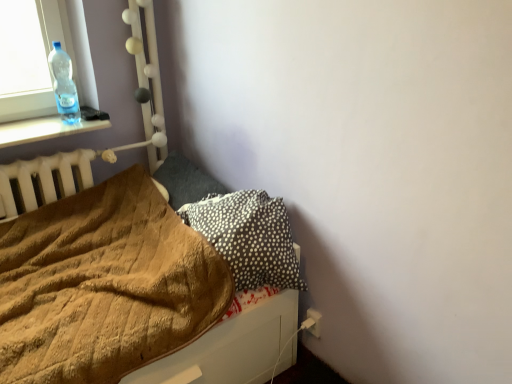
Question: Considering their positions, is black dotted pillow at lower right, acting as the 2th pillow starting from the back, located in front of or behind dark gray fabric pillow at center-left, which appears as the 1th pillow when viewed from the back?

Choices:
 (A) front
 (B) behind

Answer: (A)

Question: In terms of size, does black dotted pillow at lower right, acting as the 2th pillow starting from the back, appear bigger or smaller than dark gray fabric pillow at center-left, which appears as the 1th pillow when viewed from the back?

Choices:
 (A) small
 (B) big

Answer: (B)

Question: Estimate the real-world distances between objects in this image. Which object is closer to the dark gray fabric pillow at center-left, placed as the 2th pillow when sorted from front to back?

Choices:
 (A) transparent plastic bottle at upper left
 (B) black dotted pillow at lower right, marked as the 1th pillow in a front-to-back arrangement
 (C) brown fuzzy blanket at lower left

Answer: (B)

Question: Which is farther from the brown fuzzy blanket at lower left?

Choices:
 (A) dark gray fabric pillow at center-left, placed as the 2th pillow when sorted from front to back
 (B) transparent plastic bottle at upper left
 (C) black dotted pillow at lower right, acting as the 2th pillow starting from the back

Answer: (B)